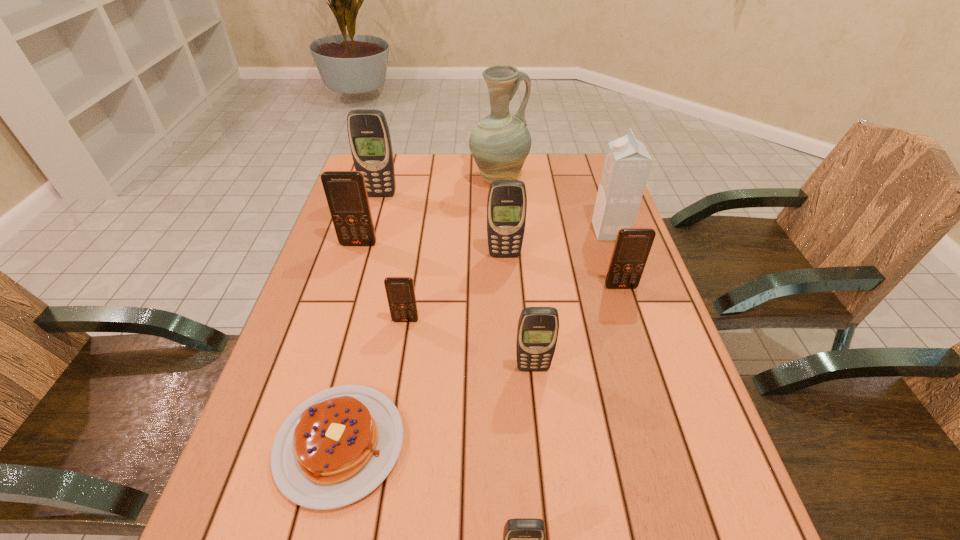
Locate an element on the screen. The width and height of the screenshot is (960, 540). vacant space located 0.220m on the screen of the biggest gray cellular telephone is located at coordinates (366, 243).

Find the location of a particular element. The height and width of the screenshot is (540, 960). vacant region located on the screen of the leftmost orange cellular telephone is located at coordinates (330, 338).

What are the coordinates of `vacant region located on the screen of the third nearest gray cellular telephone` in the screenshot? It's located at (507, 294).

You are a GUI agent. You are given a task and a screenshot of the screen. Output one action in this format:
    pyautogui.click(x=<x>, y=<y>)
    Task: Click on the free space located 0.220m on the screen of the third nearest object
    Image resolution: width=960 pixels, height=540 pixels.
    Given the screenshot: What is the action you would take?
    pyautogui.click(x=544, y=482)

You are a GUI agent. You are given a task and a screenshot of the screen. Output one action in this format:
    pyautogui.click(x=<x>, y=<y>)
    Task: Click on the free spot located on the screen of the fourth nearest cellular telephone
    
    Given the screenshot: What is the action you would take?
    [x=639, y=346]

Locate an element on the screen. vacant space situated on the screen of the second orange cellular telephone from left to right is located at coordinates (381, 475).

Where is `free space located on the back of the pancake`? free space located on the back of the pancake is located at coordinates (358, 367).

At what (x,y) coordinates should I click in order to perform the action: click on object that is positioned at the far edge. Please return your answer as a coordinate pair (x, y). This screenshot has height=540, width=960. Looking at the image, I should click on (500, 143).

The image size is (960, 540). In order to click on pancake positioned at the left edge in this screenshot , I will do `click(337, 446)`.

I want to click on carton at the right edge, so click(627, 164).